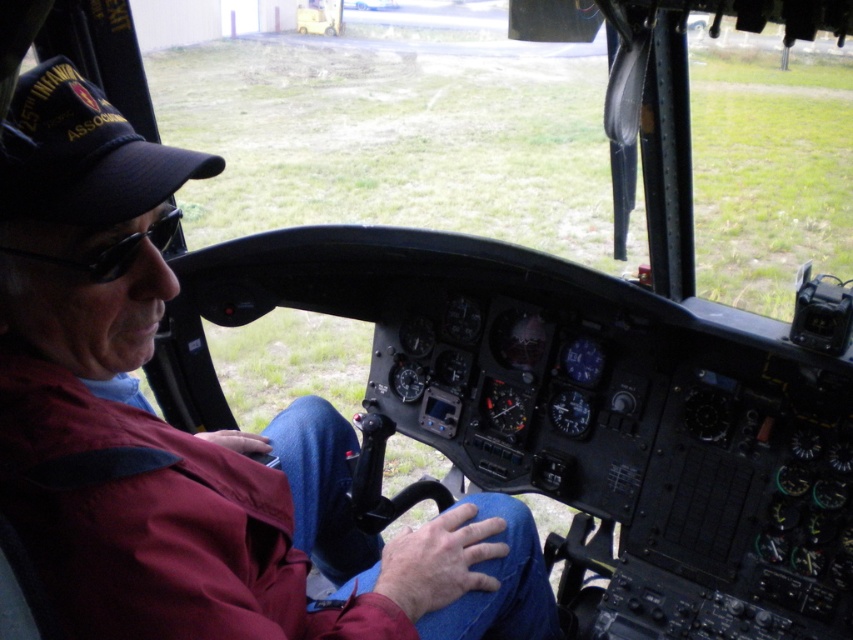
Question: Which point is closer to the camera?

Choices:
 (A) click(x=119, y=122)
 (B) click(x=170, y=230)

Answer: (A)

Question: Does black fabric cap at upper left appear on the left side of black plastic goggles at left?

Choices:
 (A) yes
 (B) no

Answer: (A)

Question: Is black fabric cap at upper left positioned at the back of black plastic goggles at left?

Choices:
 (A) no
 (B) yes

Answer: (A)

Question: Among these points, which one is nearest to the camera?

Choices:
 (A) (68, 109)
 (B) (96, 259)

Answer: (A)

Question: Can you confirm if black fabric cap at upper left is positioned below black plastic goggles at left?

Choices:
 (A) no
 (B) yes

Answer: (A)

Question: Among these points, which one is nearest to the camera?

Choices:
 (A) (10, 163)
 (B) (165, 236)

Answer: (A)